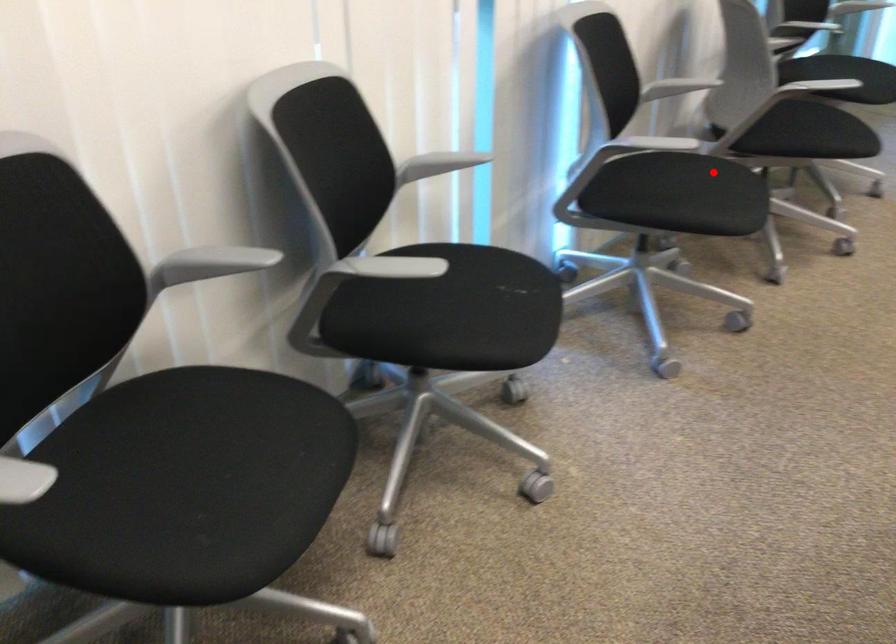
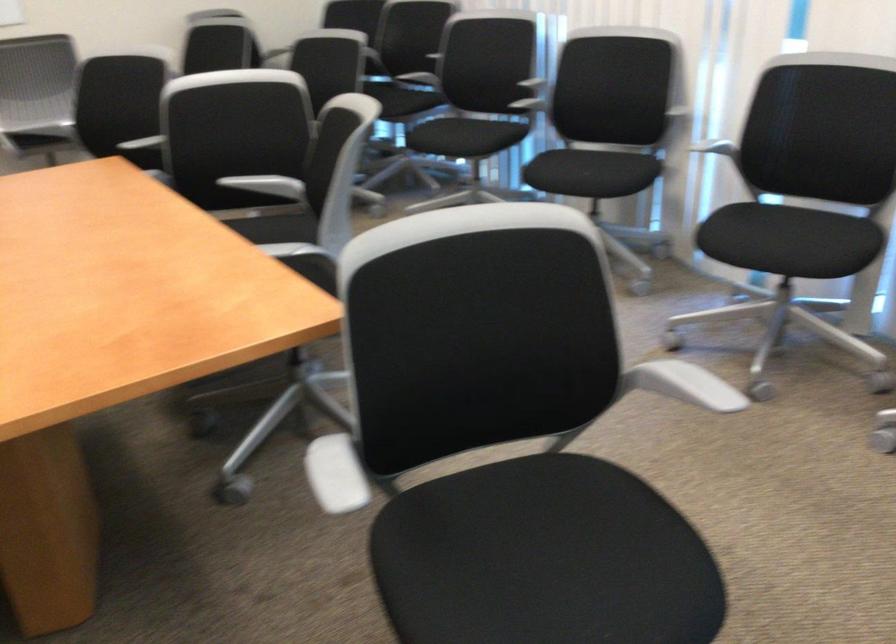
In the second image, find the point that corresponds to the highlighted location in the first image.

(789, 240)